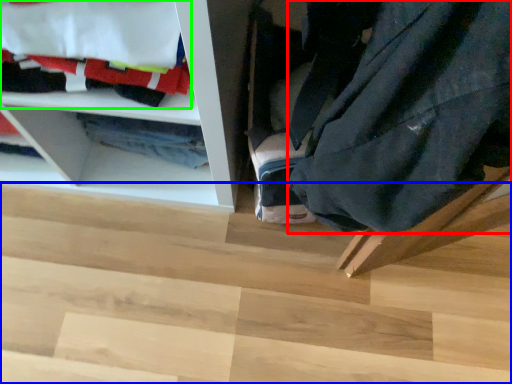
Question: Which object is positioned farthest from clothing (highlighted by a red box)? Select from stair (highlighted by a blue box) and laundry (highlighted by a green box).

Choices:
 (A) stair
 (B) laundry

Answer: (A)